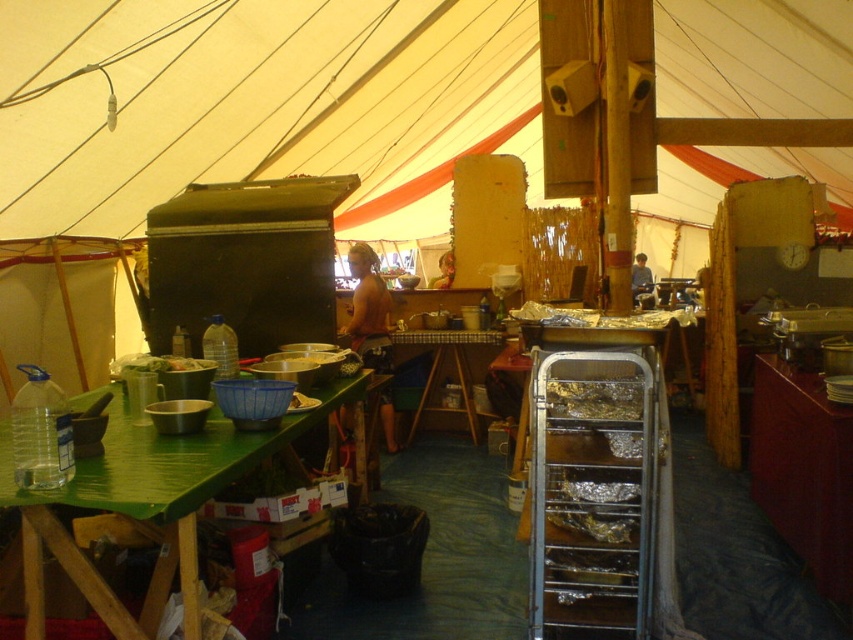
You are setting up for an event and need to place a 2.0 meter long banner between the green bamboo table at lower left and the brown wood table at lower right. Will there be enough space to stretch the banner between them?

The distance between the green bamboo table at lower left and the brown wood table at lower right is 2.10 meters, which is slightly longer than the 2.0 meter banner. Therefore, there is enough space to stretch the banner between them.

Based on the photo, you are setting up a buffet line in the tent. You need to place a 6.5 feet long serving tray between the brown wood table at lower right and the wooden table at center. Will the tray fit between them?

The distance between the brown wood table at lower right and the wooden table at center is 7.38 feet, which is longer than the 6.5 feet serving tray. Therefore, the tray will fit between them with some space to spare.